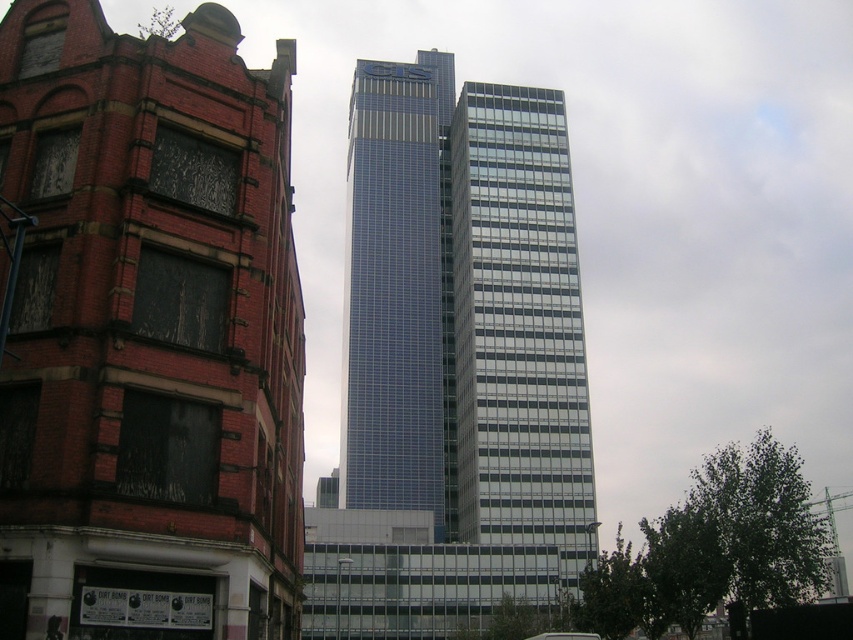
Question: Does blue glassy tower at center have a lesser width compared to blue glass skyscraper at center?

Choices:
 (A) no
 (B) yes

Answer: (A)

Question: Can you confirm if blue glassy tower at center is positioned above blue glass skyscraper at center?

Choices:
 (A) no
 (B) yes

Answer: (A)

Question: Which point appears closest to the camera in this image?

Choices:
 (A) (398, 192)
 (B) (366, 369)

Answer: (B)

Question: Which of the following is the closest to the observer?

Choices:
 (A) blue glass skyscraper at center
 (B) blue glassy tower at center

Answer: (B)

Question: Considering the relative positions of blue glassy tower at center and blue glass skyscraper at center in the image provided, where is blue glassy tower at center located with respect to blue glass skyscraper at center?

Choices:
 (A) right
 (B) left

Answer: (B)